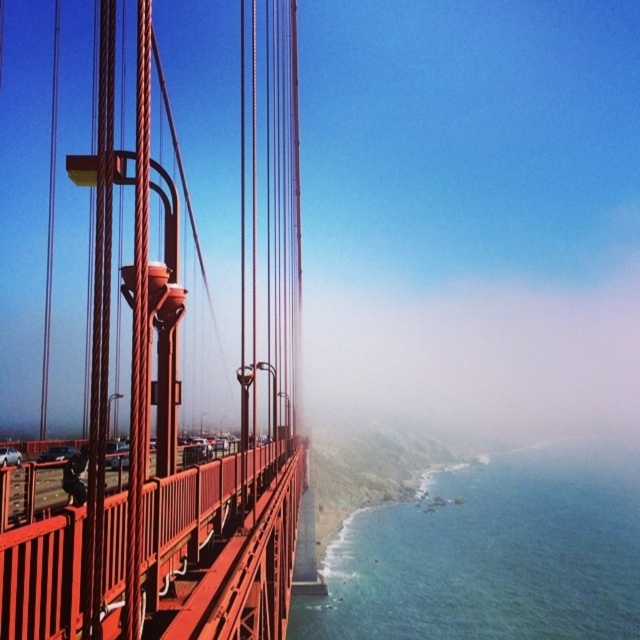
Is smooth metal suspension bridge at left smaller than blue water at lower right?

Incorrect, smooth metal suspension bridge at left is not smaller in size than blue water at lower right.

Does smooth metal suspension bridge at left appear under blue water at lower right?

Actually, smooth metal suspension bridge at left is above blue water at lower right.

Describe the element at coordinates (177, 397) in the screenshot. The width and height of the screenshot is (640, 640). I see `smooth metal suspension bridge at left` at that location.

Locate an element on the screen. This screenshot has height=640, width=640. smooth metal suspension bridge at left is located at coordinates (177, 397).